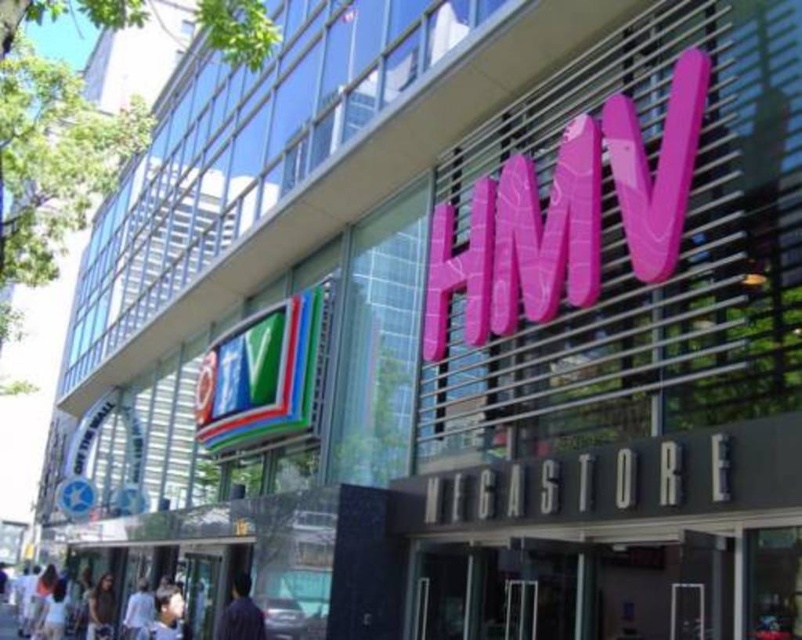
Question: Which point is closer to the camera?

Choices:
 (A) dark brown leather jacket at lower left
 (B) white fabric shirt at lower left
 (C) light blue shirt at lower left

Answer: (C)

Question: Can you confirm if purple fabric shirt at lower left is bigger than dark brown leather jacket at lower left?

Choices:
 (A) yes
 (B) no

Answer: (B)

Question: Is light blue shirt at lower left to the left of dark brown leather jacket at lower left from the viewer's perspective?

Choices:
 (A) no
 (B) yes

Answer: (A)

Question: Which object appears closest to the camera in this image?

Choices:
 (A) light blue shirt at lower left
 (B) dark brown leather jacket at lower left

Answer: (A)

Question: Which point is farther from the camera taking this photo?

Choices:
 (A) (225, 636)
 (B) (136, 634)
 (C) (88, 632)
 (D) (165, 632)

Answer: (C)

Question: Observing the image, what is the correct spatial positioning of light blue shirt at lower left in reference to white fabric shirt at lower left?

Choices:
 (A) below
 (B) above

Answer: (A)